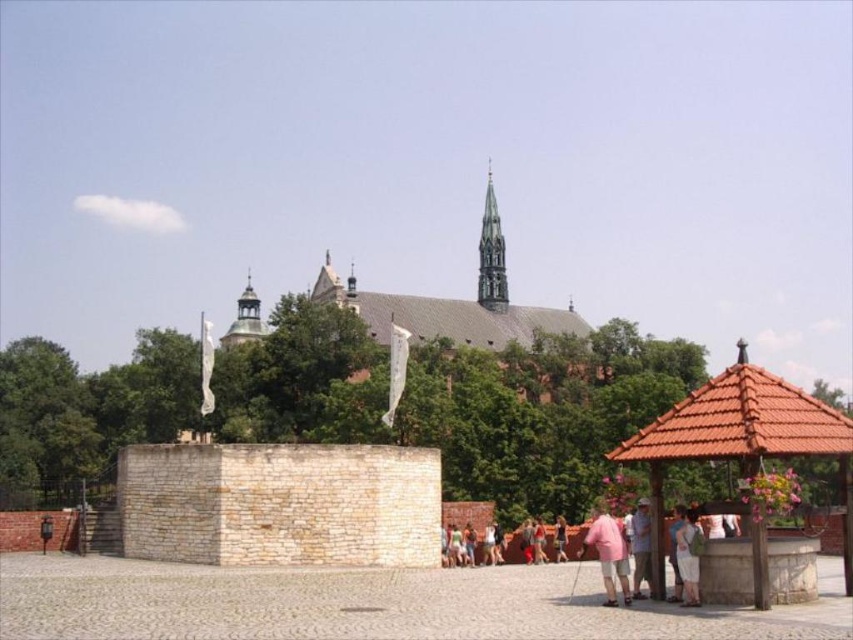
Is brown tiled gazebo at lower right positioned at the back of pink fabric dress at lower center?

No, it is not.

Is brown tiled gazebo at lower right taller than pink fabric dress at lower center?

Correct, brown tiled gazebo at lower right is much taller as pink fabric dress at lower center.

The image size is (853, 640). What are the coordinates of `brown tiled gazebo at lower right` in the screenshot? It's located at (740, 436).

Is brown stone church at center shorter than gray stone spire at center?

No.

Which of these two, brown stone church at center or gray stone spire at center, stands taller?

Standing taller between the two is brown stone church at center.

Which is in front, point (474, 307) or point (489, 221)?

Point (474, 307) is in front.

I want to click on brown stone church at center, so (x=453, y=301).

What do you see at coordinates (491, 253) in the screenshot? The width and height of the screenshot is (853, 640). I see `gray stone spire at center` at bounding box center [491, 253].

Locate an element on the screen. The height and width of the screenshot is (640, 853). gray stone spire at center is located at coordinates (491, 253).